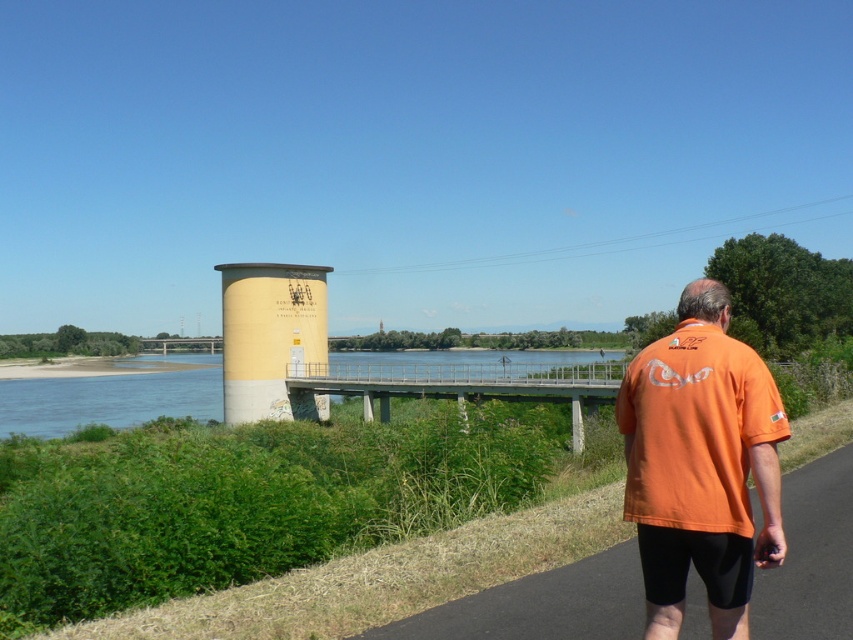
Question: Does orange fabric shirt at right have a greater width compared to metallic gray bridge at center?

Choices:
 (A) no
 (B) yes

Answer: (A)

Question: Which point is closer to the camera?

Choices:
 (A) (256, 388)
 (B) (514, 371)
 (C) (685, 300)
 (D) (820, 572)

Answer: (C)

Question: Among these points, which one is nearest to the camera?

Choices:
 (A) (227, 356)
 (B) (407, 371)

Answer: (B)

Question: Which object appears closest to the camera in this image?

Choices:
 (A) orange fabric shirt at right
 (B) yellow concrete pillar at center

Answer: (A)

Question: Can you confirm if black asphalt bike path at lower right is bigger than yellow concrete pillar at center?

Choices:
 (A) yes
 (B) no

Answer: (B)

Question: Where is orange fabric shirt at right located in relation to black asphalt bike path at lower right in the image?

Choices:
 (A) below
 (B) above

Answer: (B)